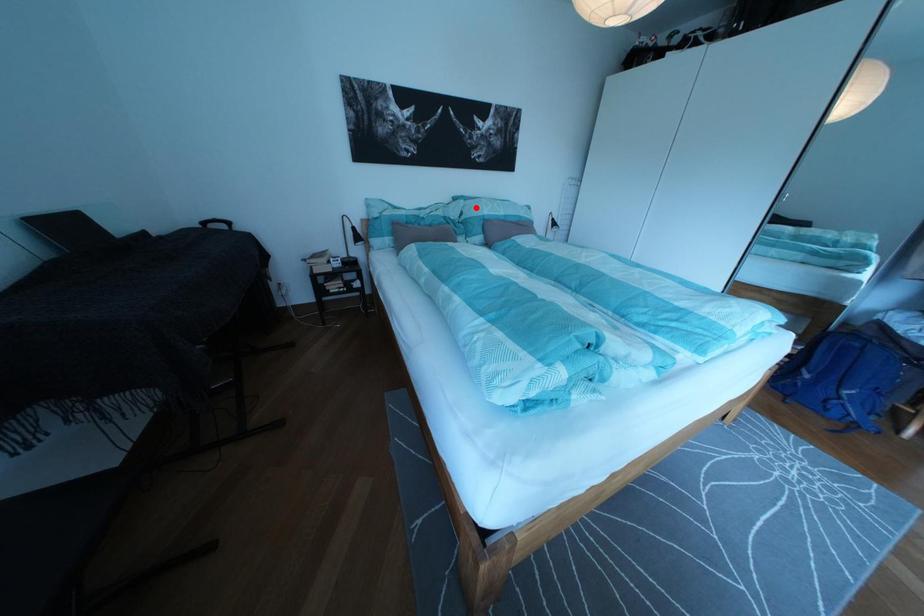
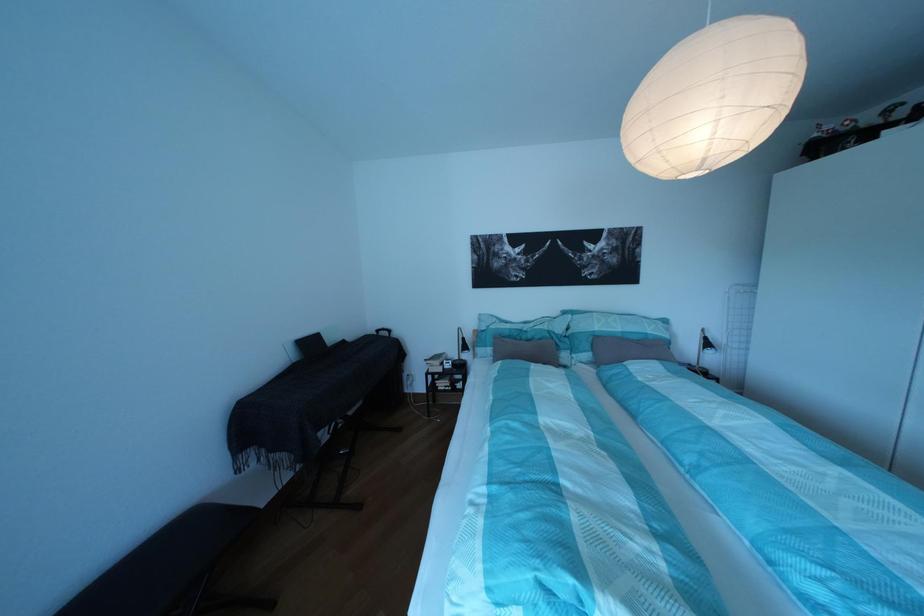
Where in the second image is the point corresponding to the highlighted location from the first image?

(582, 322)